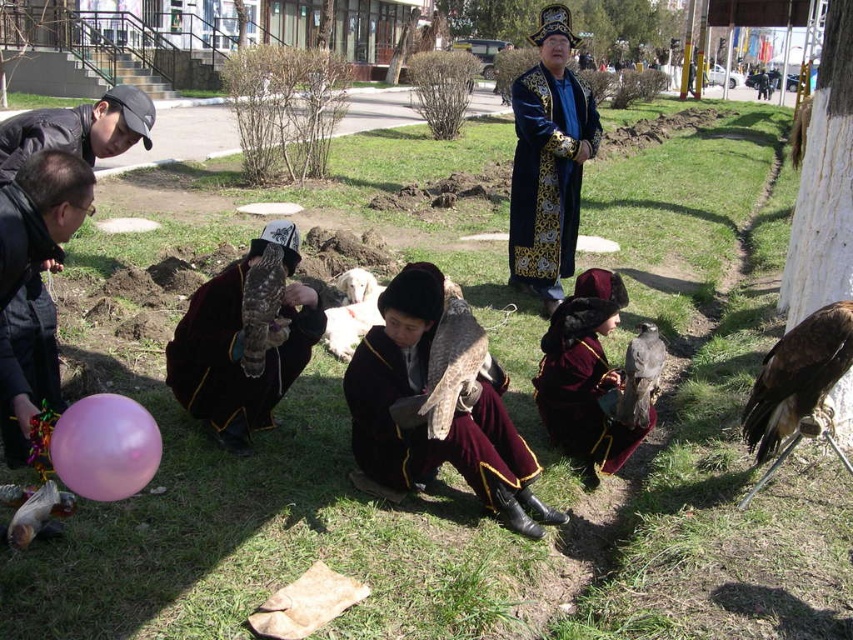
You are standing at the origin point in the image. Which of the two points, point (x=611, y=378) or point (x=807, y=323), is closer to you?

Point (x=807, y=323) is closer to you because it is in front of point (x=611, y=378).